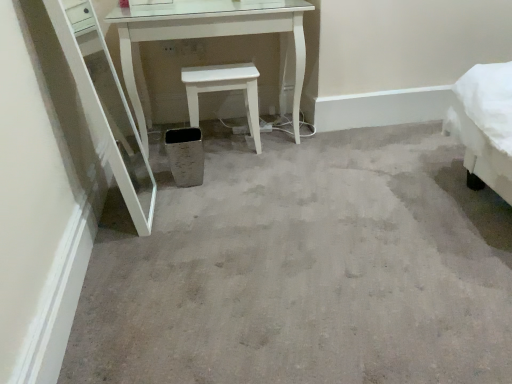
The width and height of the screenshot is (512, 384). Find the location of `metallic gray trash bin/can at center`. metallic gray trash bin/can at center is located at coordinates (185, 156).

What do you see at coordinates (185, 156) in the screenshot?
I see `metallic gray trash bin/can at center` at bounding box center [185, 156].

This screenshot has width=512, height=384. I want to click on white matte stool at center, so click(x=224, y=90).

What do you see at coordinates (224, 90) in the screenshot? This screenshot has height=384, width=512. I see `white matte stool at center` at bounding box center [224, 90].

What is the approximate height of white matte stool at center?

A: white matte stool at center is 46.96 centimeters tall.

The width and height of the screenshot is (512, 384). In order to click on metallic gray trash bin/can at center in this screenshot , I will do `click(185, 156)`.

In the scene shown: Is metallic gray trash bin/can at center to the right of white matte stool at center from the viewer's perspective?

Incorrect, metallic gray trash bin/can at center is not on the right side of white matte stool at center.

Relative to white matte stool at center, is metallic gray trash bin/can at center in front or behind?

In the image, metallic gray trash bin/can at center appears in front of white matte stool at center.

Considering the positions of points (175, 133) and (216, 91), is point (175, 133) farther from camera compared to point (216, 91)?

No, (175, 133) is in front of (216, 91).

From the image's perspective, relative to white matte stool at center, is metallic gray trash bin/can at center above or below?

Clearly, from the image's perspective, metallic gray trash bin/can at center is below white matte stool at center.

From a real-world perspective, is metallic gray trash bin/can at center positioned under white matte stool at center based on gravity?

Yes, from a real-world perspective, metallic gray trash bin/can at center is beneath white matte stool at center.

Can you confirm if metallic gray trash bin/can at center is thinner than white matte stool at center?

Indeed, metallic gray trash bin/can at center has a lesser width compared to white matte stool at center.

Who is shorter, metallic gray trash bin/can at center or white matte stool at center?

metallic gray trash bin/can at center is shorter.

Is metallic gray trash bin/can at center bigger than white matte stool at center?

Incorrect, metallic gray trash bin/can at center is not larger than white matte stool at center.

Does metallic gray trash bin/can at center contain white matte stool at center?

No, white matte stool at center is not a part of metallic gray trash bin/can at center.

Is metallic gray trash bin/can at center touching white matte stool at center?

No.

Is white matte stool at center at the back of metallic gray trash bin/can at center?

No, metallic gray trash bin/can at center is not facing away from white matte stool at center.

What's the angular difference between metallic gray trash bin/can at center and white matte stool at center's facing directions?

The angle between the facing direction of metallic gray trash bin/can at center and the facing direction of white matte stool at center is 5.16 degrees.

Identify the location of trash bin/can below the white matte stool at center (from the image's perspective). This screenshot has height=384, width=512. (185, 156).

Considering the relative positions of white matte stool at center and metallic gray trash bin/can at center in the image provided, is white matte stool at center to the left of metallic gray trash bin/can at center from the viewer's perspective?

No, white matte stool at center is not to the left of metallic gray trash bin/can at center.

Which object is further away from the camera taking this photo, white matte stool at center or metallic gray trash bin/can at center?

white matte stool at center.

Does point (183, 73) come behind point (199, 136)?

Yes.

From the image's perspective, which one is positioned lower, white matte stool at center or metallic gray trash bin/can at center?

metallic gray trash bin/can at center, from the image's perspective.

From a real-world perspective, does white matte stool at center sit lower than metallic gray trash bin/can at center?

No, from a real-world perspective, white matte stool at center is not below metallic gray trash bin/can at center.

Considering the relative sizes of white matte stool at center and metallic gray trash bin/can at center in the image provided, is white matte stool at center wider than metallic gray trash bin/can at center?

Indeed, white matte stool at center has a greater width compared to metallic gray trash bin/can at center.

Is white matte stool at center shorter than metallic gray trash bin/can at center?

In fact, white matte stool at center may be taller than metallic gray trash bin/can at center.

Can you confirm if white matte stool at center is smaller than metallic gray trash bin/can at center?

No, white matte stool at center is not smaller than metallic gray trash bin/can at center.

Would you say white matte stool at center is outside metallic gray trash bin/can at center?

white matte stool at center is positioned outside metallic gray trash bin/can at center.

Are white matte stool at center and metallic gray trash bin/can at center far apart?

No, white matte stool at center is not far from metallic gray trash bin/can at center.

Is white matte stool at center turned away from metallic gray trash bin/can at center?

That's not correct — white matte stool at center is not looking away from metallic gray trash bin/can at center.

Consider the image. How far apart are white matte stool at center and metallic gray trash bin/can at center?

white matte stool at center and metallic gray trash bin/can at center are 8.77 inches apart.

Locate an element on the screen. This screenshot has height=384, width=512. trash bin/can below the white matte stool at center (from a real-world perspective) is located at coordinates (185, 156).

Identify the location of stool on the right of metallic gray trash bin/can at center. The height and width of the screenshot is (384, 512). (224, 90).

Image resolution: width=512 pixels, height=384 pixels. In order to click on trash bin/can located in front of the white matte stool at center in this screenshot , I will do `click(185, 156)`.